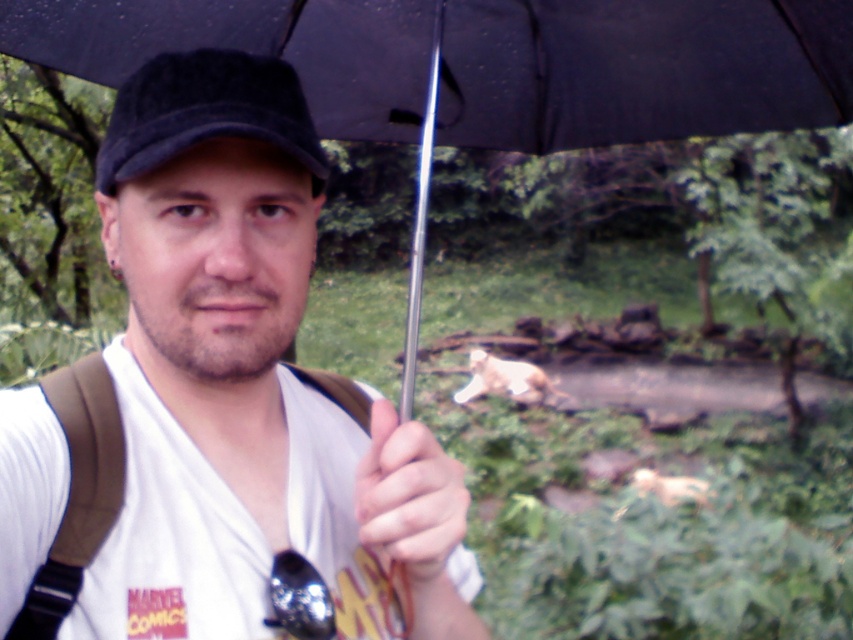
You are a photographer trying to capture a closeup shot of the smooth skin hand at center holding the black matte umbrella at upper center. Given their positions, will the hand be fully visible in the photo without any obstruction from the umbrella?

The black matte umbrella at upper center is much taller than the smooth skin hand at center, so the umbrella will likely obstruct the hand in the photo, making it partially or fully hidden.